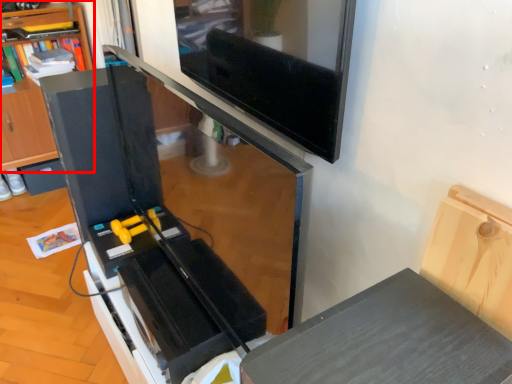
Question: From the image's perspective, what is the correct spatial relationship of shelf (annotated by the red box) in relation to drawer?

Choices:
 (A) above
 (B) below

Answer: (A)